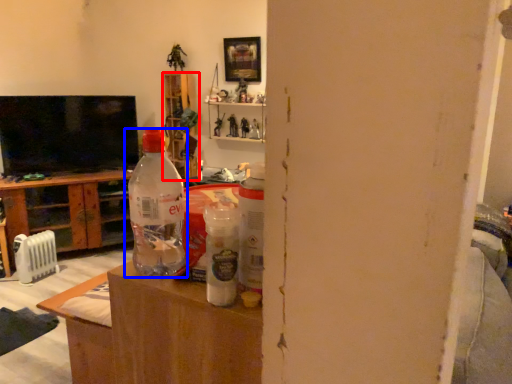
Question: Which object is further to the camera taking this photo, shelf (highlighted by a red box) or bottle (highlighted by a blue box)?

Choices:
 (A) shelf
 (B) bottle

Answer: (A)